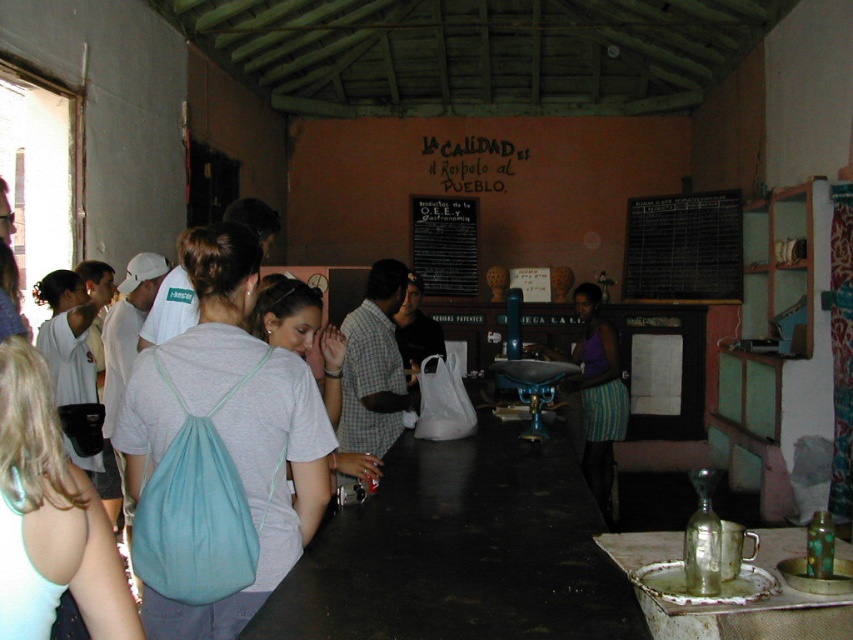
Which is in front, point (811, 630) or point (660, 211)?

Point (811, 630)

Which of these two, rusty metal tray at lower right or black chalkboard at upper right, stands shorter?

rusty metal tray at lower right is shorter.

Find the location of a particular element. This screenshot has height=640, width=853. rusty metal tray at lower right is located at coordinates (751, 618).

I want to click on rusty metal tray at lower right, so click(x=751, y=618).

Does point (444, 570) lie in front of point (457, 246)?

Yes, it is.

Does black matte table at center come behind black chalkboard at center?

No.

The image size is (853, 640). Describe the element at coordinates (460, 552) in the screenshot. I see `black matte table at center` at that location.

Where is `black matte table at center`? This screenshot has height=640, width=853. black matte table at center is located at coordinates (460, 552).

This screenshot has height=640, width=853. What do you see at coordinates (57, 499) in the screenshot? I see `white fabric backpack at center` at bounding box center [57, 499].

Which is in front, point (67, 579) or point (582, 406)?

Point (67, 579) is more forward.

Identify the location of white fabric backpack at center. (57, 499).